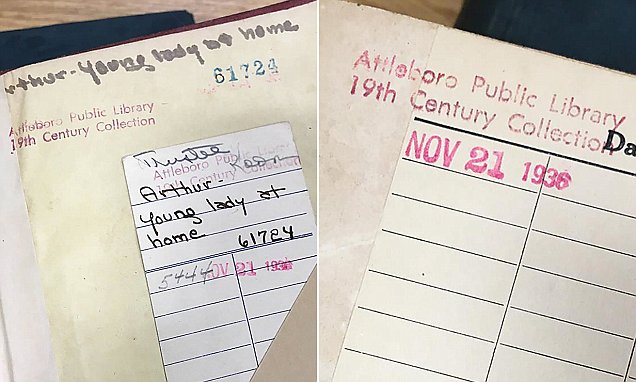
At what (x,y) coordinates should I click in order to perform the action: click on blue book. Please return your answer as a coordinate pair (x, y). Looking at the image, I should click on (53, 34).